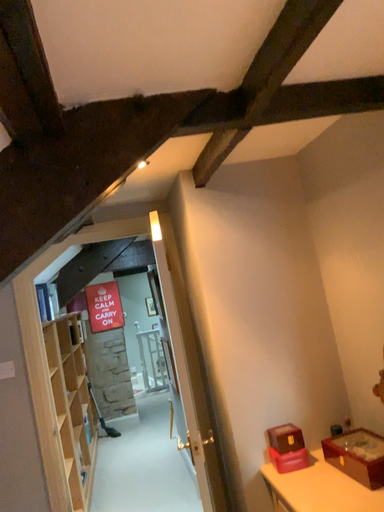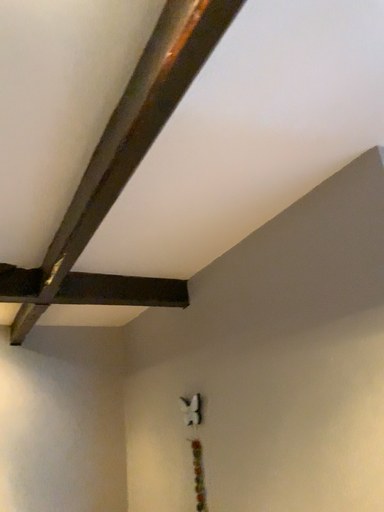
Question: Which way did the camera rotate in the video?

Choices:
 (A) rotated left
 (B) rotated right

Answer: (B)